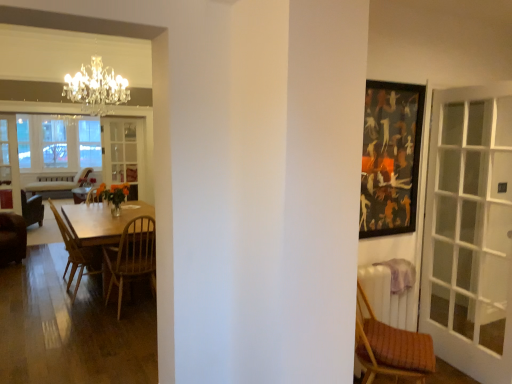
Identify the location of vacant area that lies between wooden at left, which is the third chair from back to front, and wooden table at left. (99, 325).